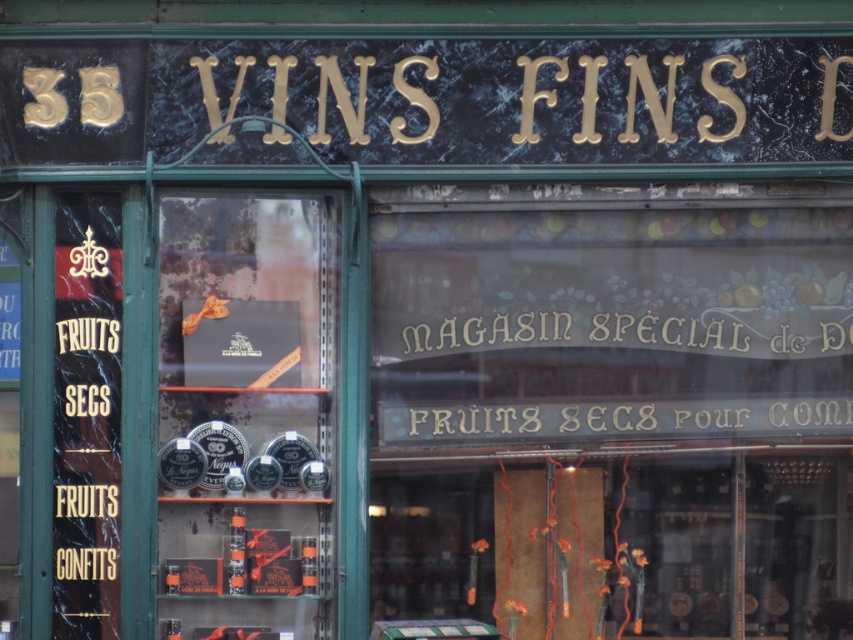
In the scene shown: You are a customer standing in front of the shop window. You see the transparent glass signboard at center and the matte black box at center. Which one is closer to the bottom of the window?

The transparent glass signboard at center is located below the matte black box at center, so it is closer to the bottom of the window.

Where is the transparent glass signboard at center located in the scene?

The transparent glass signboard at center is located at point (613, 410) in the scene.

You are a customer entering the store and see the matte black box at center and the white metallic sign at center. Which object is closer to the floor?

The matte black box at center is located below the white metallic sign at center, so it is closer to the floor than the white metallic sign at center.